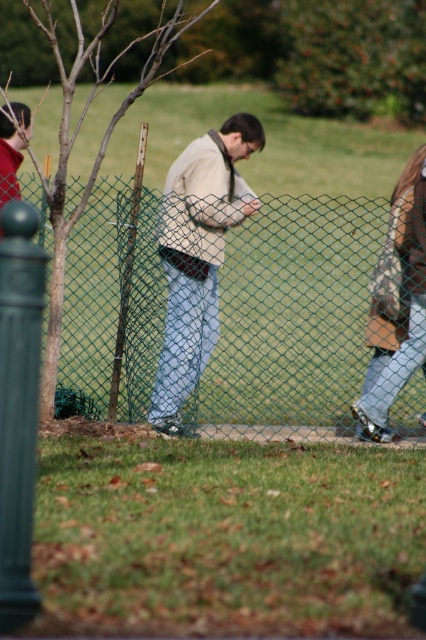
Question: Considering the real-world distances, which object is closest to the matte black jacket at left?

Choices:
 (A) camouflage jacket at right
 (B) green chain-link fence at center
 (C) light beige sweater at center

Answer: (C)

Question: Estimate the real-world distances between objects in this image. Which object is farther from the matte black jacket at left?

Choices:
 (A) camouflage jacket at right
 (B) green chain-link fence at center
 (C) light beige sweater at center

Answer: (A)

Question: Considering the real-world distances, which object is farthest from the light beige sweater at center?

Choices:
 (A) camouflage jacket at right
 (B) matte black jacket at left

Answer: (B)

Question: Is light beige sweater at center to the left of camouflage jacket at right from the viewer's perspective?

Choices:
 (A) yes
 (B) no

Answer: (A)

Question: Can you confirm if green chain-link fence at center is positioned to the right of matte black jacket at left?

Choices:
 (A) no
 (B) yes

Answer: (B)

Question: Does green chain-link fence at center appear under matte black jacket at left?

Choices:
 (A) yes
 (B) no

Answer: (A)